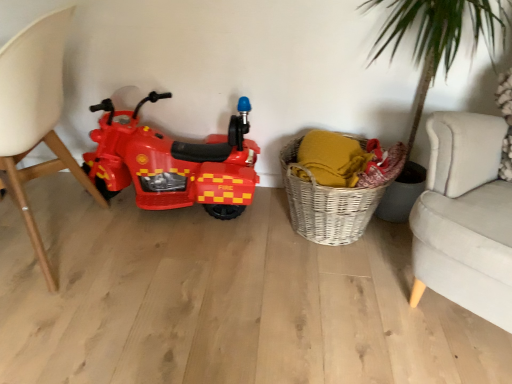
Question: Is there a large distance between matte white chair at left and shiny plastic toy motorcycle at left?

Choices:
 (A) no
 (B) yes

Answer: (A)

Question: Can you confirm if matte white chair at left is positioned to the right of shiny plastic toy motorcycle at left?

Choices:
 (A) yes
 (B) no

Answer: (B)

Question: Is matte white chair at left positioned behind shiny plastic toy motorcycle at left?

Choices:
 (A) yes
 (B) no

Answer: (B)

Question: From the image's perspective, does matte white chair at left appear lower than shiny plastic toy motorcycle at left?

Choices:
 (A) yes
 (B) no

Answer: (A)

Question: From a real-world perspective, is matte white chair at left beneath shiny plastic toy motorcycle at left?

Choices:
 (A) yes
 (B) no

Answer: (B)

Question: Is matte white chair at left shorter than shiny plastic toy motorcycle at left?

Choices:
 (A) no
 (B) yes

Answer: (A)

Question: From a real-world perspective, is woven wicker basket at lower right on shiny plastic toy motorcycle at left?

Choices:
 (A) no
 (B) yes

Answer: (A)

Question: Could you tell me if woven wicker basket at lower right is turned towards shiny plastic toy motorcycle at left?

Choices:
 (A) yes
 (B) no

Answer: (B)

Question: Can you confirm if woven wicker basket at lower right is positioned to the right of shiny plastic toy motorcycle at left?

Choices:
 (A) no
 (B) yes

Answer: (B)

Question: Is woven wicker basket at lower right in front of shiny plastic toy motorcycle at left?

Choices:
 (A) yes
 (B) no

Answer: (A)

Question: Does woven wicker basket at lower right have a lesser width compared to shiny plastic toy motorcycle at left?

Choices:
 (A) yes
 (B) no

Answer: (B)

Question: Considering the relative positions of woven wicker basket at lower right and shiny plastic toy motorcycle at left in the image provided, is woven wicker basket at lower right to the left of shiny plastic toy motorcycle at left from the viewer's perspective?

Choices:
 (A) yes
 (B) no

Answer: (B)

Question: Can you confirm if shiny plastic toy motorcycle at left is wider than matte white chair at left?

Choices:
 (A) no
 (B) yes

Answer: (A)